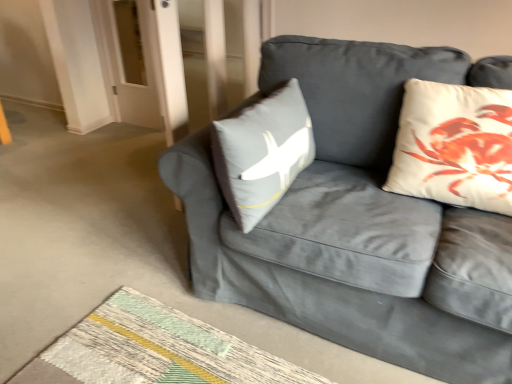
Question: Is textured woven mat at lower center spatially inside velvet gray couch at center, or outside of it?

Choices:
 (A) outside
 (B) inside

Answer: (A)

Question: In terms of height, does textured woven mat at lower center look taller or shorter compared to velvet gray couch at center?

Choices:
 (A) tall
 (B) short

Answer: (B)

Question: Which object is positioned closest to the textured woven mat at lower center?

Choices:
 (A) velvet gray couch at center
 (B) white cotton cushion at upper right

Answer: (A)

Question: Which of these objects is positioned closest to the white cotton cushion at upper right?

Choices:
 (A) textured woven mat at lower center
 (B) velvet gray couch at center

Answer: (B)